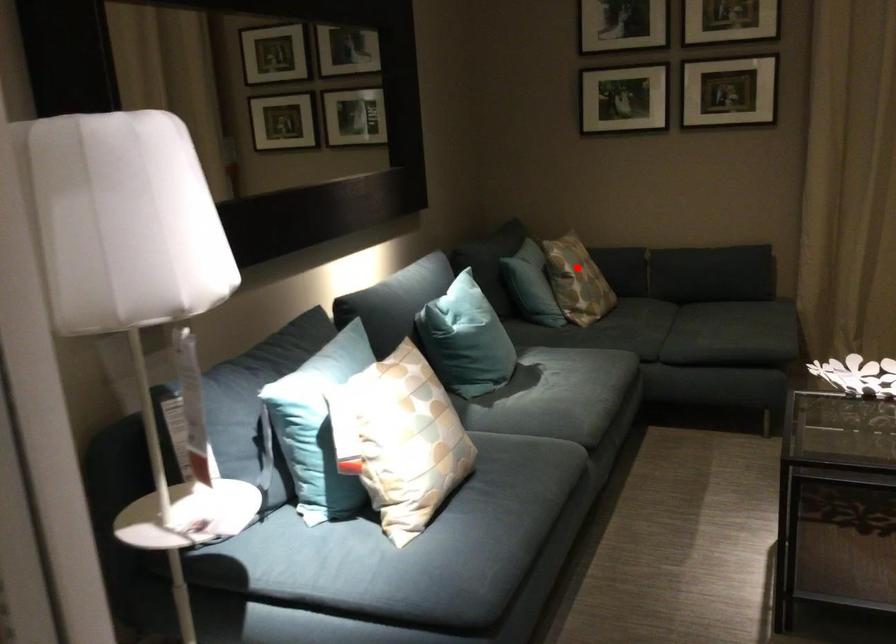
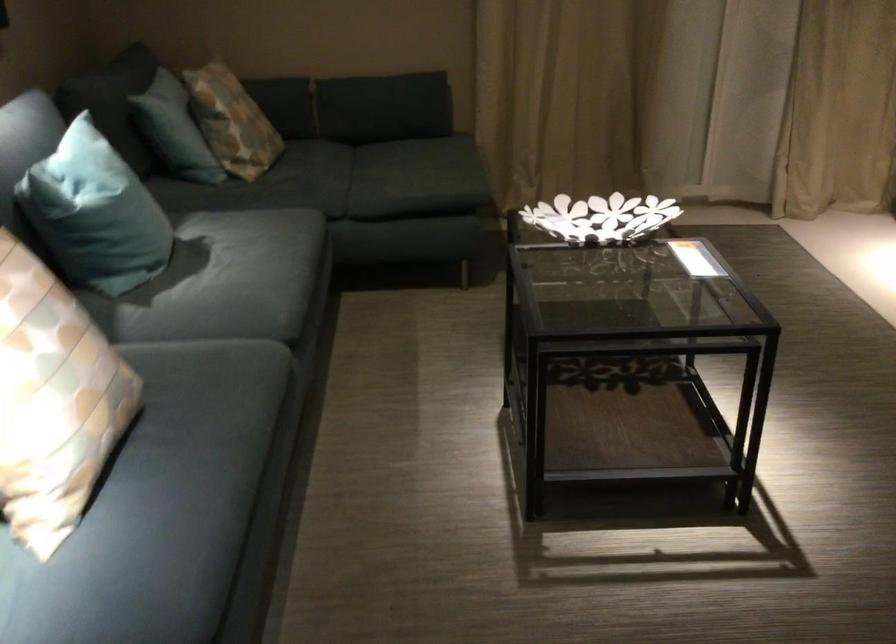
Locate, in the second image, the point that corresponds to the highlighted location in the first image.

(231, 120)